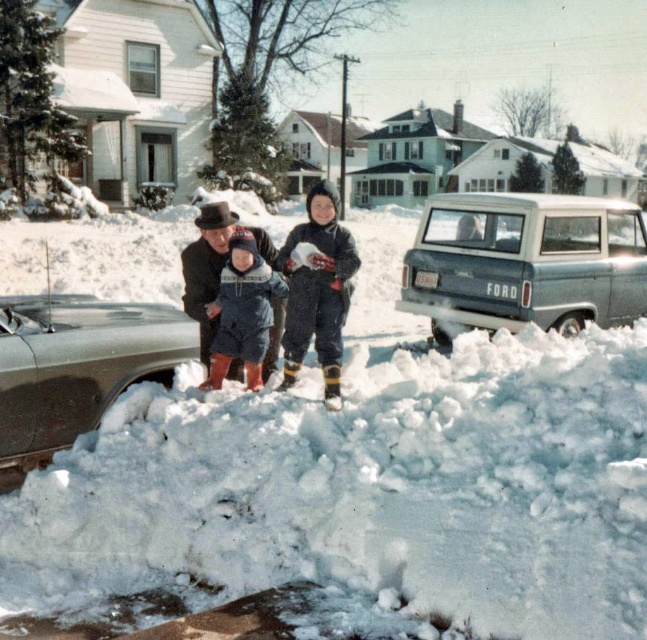
Question: Among these points, which one is nearest to the camera?

Choices:
 (A) (115, 588)
 (B) (120, 348)
 (C) (466, 282)
 (D) (237, 257)

Answer: (A)

Question: Where is white fluffy snow at center located in relation to dark blue snowsuit at center in the image?

Choices:
 (A) right
 (B) left

Answer: (B)

Question: Considering the relative positions of metallic silver van at right and blue fleece snowsuit at center in the image provided, where is metallic silver van at right located with respect to blue fleece snowsuit at center?

Choices:
 (A) above
 (B) below

Answer: (A)

Question: Among these objects, which one is nearest to the camera?

Choices:
 (A) white fluffy snow at center
 (B) dark blue snowsuit at center
 (C) metallic silver van at right
 (D) silver metallic car at center

Answer: (A)

Question: Which point is closer to the camera?

Choices:
 (A) blue fleece snowsuit at center
 (B) silver metallic car at center

Answer: (B)

Question: From the image, what is the correct spatial relationship of white fluffy snow at center in relation to dark blue snowsuit at center?

Choices:
 (A) left
 (B) right

Answer: (A)